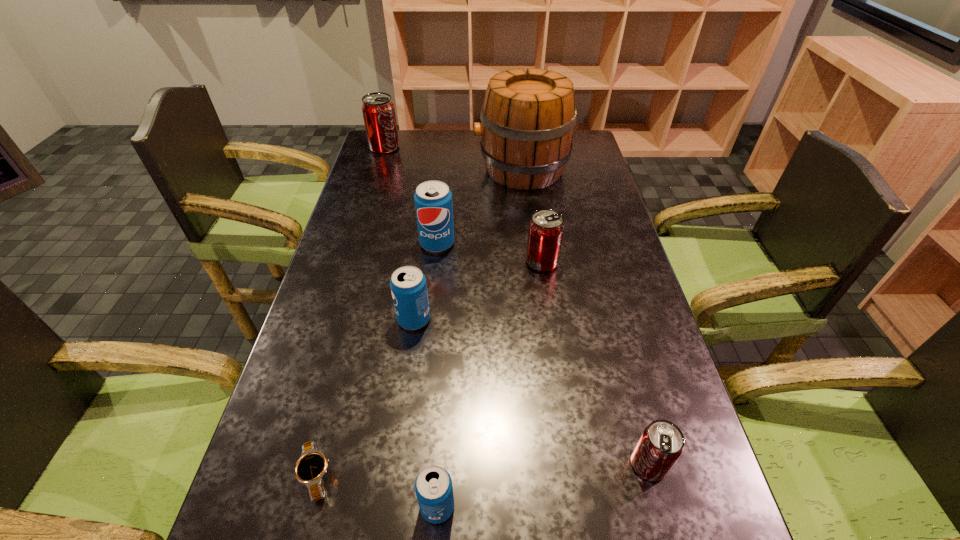
Where is `vacant point located between the nearest soda can and the tallest object`? The image size is (960, 540). vacant point located between the nearest soda can and the tallest object is located at coordinates (479, 338).

Identify the location of free space between the cider and the second farthest red pop soda. (532, 215).

I want to click on vacant region between the shortest object and the smallest blue soda can, so click(376, 491).

You are a GUI agent. You are given a task and a screenshot of the screen. Output one action in this format:
    pyautogui.click(x=<x>, y=<y>)
    Task: Click on the free space between the nearest red pop soda and the nearest blue soda can
    Image resolution: width=960 pixels, height=540 pixels.
    Given the screenshot: What is the action you would take?
    pyautogui.click(x=543, y=485)

Select which object is the second closest to the nearest blue soda can. Please provide its 2D coordinates. Your answer should be formatted as a tuple, i.e. [(x, y)], where the tuple contains the x and y coordinates of a point satisfying the conditions above.

[(661, 444)]

Find the location of a particular element. This screenshot has height=540, width=960. object that can be found as the closest to the leftmost soda can is located at coordinates (528, 118).

Locate an element on the screen. the fifth closest soda can relative to the biggest blue soda can is located at coordinates (661, 444).

This screenshot has height=540, width=960. What are the coordinates of `soda can that is the closest to the nearest soda can` in the screenshot? It's located at (661, 444).

Identify which red pop soda is the third closest to the tallest object. Please provide its 2D coordinates. Your answer should be formatted as a tuple, i.e. [(x, y)], where the tuple contains the x and y coordinates of a point satisfying the conditions above.

[(661, 444)]

This screenshot has width=960, height=540. What are the coordinates of `the second closest red pop soda to the rightmost soda can` in the screenshot? It's located at (378, 110).